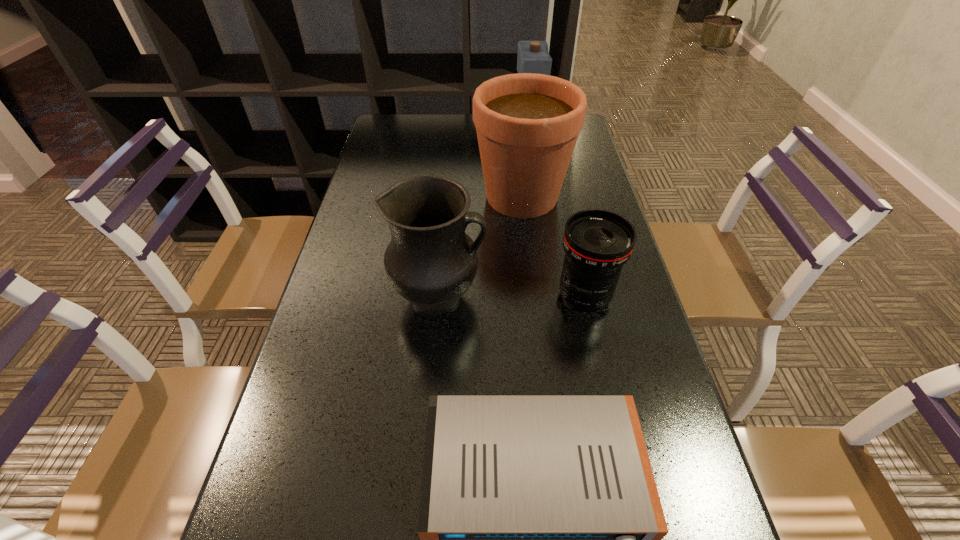
You are a GUI agent. You are given a task and a screenshot of the screen. Output one action in this format:
    pyautogui.click(x=<x>, y=<y>)
    Task: Click on the free space between the farthest object and the telephoto lens
    The height and width of the screenshot is (540, 960).
    Given the screenshot: What is the action you would take?
    pyautogui.click(x=556, y=214)

This screenshot has height=540, width=960. I want to click on free spot between the flowerpot and the pitcher, so click(x=480, y=247).

This screenshot has width=960, height=540. Find the location of `unoccupied position between the fourth tallest object and the pitcher`. unoccupied position between the fourth tallest object and the pitcher is located at coordinates (512, 297).

Locate an element on the screen. The width and height of the screenshot is (960, 540). empty space between the pitcher and the flowerpot is located at coordinates (480, 247).

Identify the location of object that is the fourth closest one to the flowerpot. (540, 524).

This screenshot has height=540, width=960. What are the coordinates of `object identified as the closest to the shortest object` in the screenshot? It's located at (431, 262).

At what (x,y) coordinates should I click in order to perform the action: click on vacant region that satisfies the following two spatial constraints: 1. on the back side of the farthest object; 2. on the left side of the flowerpot. Please return your answer as a coordinate pair (x, y). The width and height of the screenshot is (960, 540). Looking at the image, I should click on (515, 131).

Find the location of a particular element. vacant space that satisfies the following two spatial constraints: 1. on the front side of the second shortest object; 2. on the handle side of the pitcher is located at coordinates (585, 297).